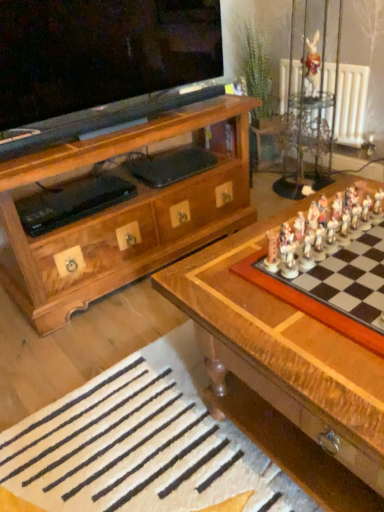
Locate an element on the screen. This screenshot has height=512, width=384. free space behind white wool rug at lower center is located at coordinates (92, 337).